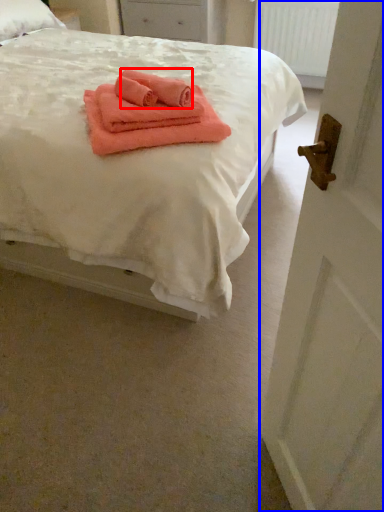
Question: Which object appears closest to the camera in this image, cloth (highlighted by a red box) or door (highlighted by a blue box)?

Choices:
 (A) cloth
 (B) door

Answer: (B)